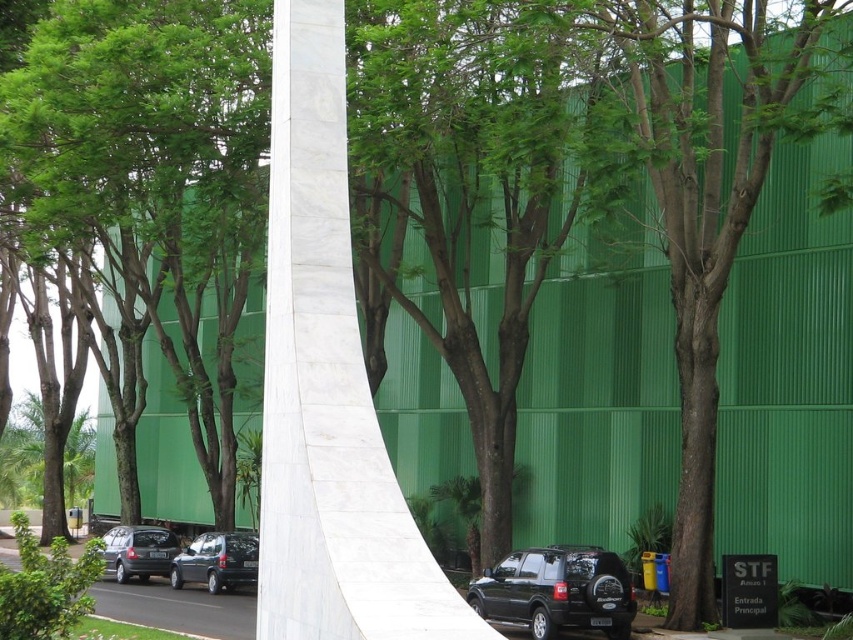
Which is behind, point (543, 596) or point (242, 570)?

The point (242, 570) is more distant.

Between black matte suv at lower center and matte black car at center, which one appears on the left side from the viewer's perspective?

Positioned to the left is matte black car at center.

Is point (607, 595) positioned before point (241, 540)?

Yes, it is.

The height and width of the screenshot is (640, 853). Identify the location of black matte suv at lower center. (556, 589).

Which is more to the right, white marble pillar at center or matte black car at center?

white marble pillar at center

This screenshot has width=853, height=640. In order to click on white marble pillar at center in this screenshot , I will do `click(328, 387)`.

Does black matte suv at lower center come in front of matte black suv at center?

Yes, black matte suv at lower center is closer to the viewer.

Is point (532, 625) less distant than point (149, 570)?

That is True.

Who is more forward, (561, 609) or (125, 552)?

Point (561, 609) is more forward.

You are a GUI agent. You are given a task and a screenshot of the screen. Output one action in this format:
    pyautogui.click(x=<x>, y=<y>)
    Task: Click on the black matte suv at lower center
    The image size is (853, 640).
    Given the screenshot: What is the action you would take?
    pyautogui.click(x=556, y=589)